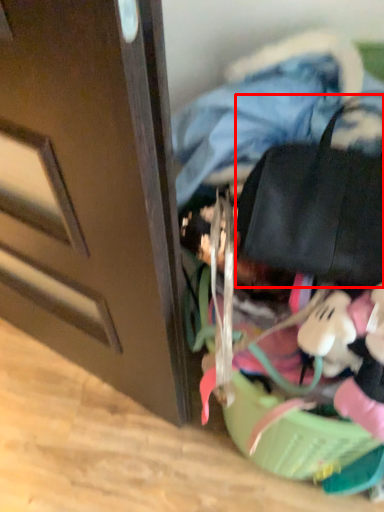
Question: In this image, where is messenger bag (annotated by the red box) located relative to clothing?

Choices:
 (A) right
 (B) left

Answer: (A)